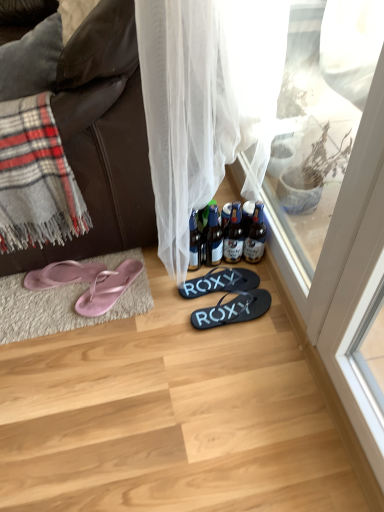
Find the location of a particular element. The image size is (384, 512). dark brown leather couch at left is located at coordinates (102, 139).

What is the approximate width of black rubber flip flops at center, placed as the 2th footwear when sorted from right to left?

black rubber flip flops at center, placed as the 2th footwear when sorted from right to left, is 11.16 inches wide.

Consider the image. Measure the distance between translucent glass bottle at center, which is counted as the 3th bottle, starting from the left, and camera.

translucent glass bottle at center, which is counted as the 3th bottle, starting from the left, is 4.46 feet from camera.

What is the approximate width of translucent glass bottle at center, which ranks as the second bottle in right-to-left order?

3.27 inches.

Identify the location of dark brown leather couch at left. This screenshot has width=384, height=512. (102, 139).

Where is `the 4th bottle behind when counting from the black rubber flip flops at center, which appears as the 1th footwear when viewed from the right`? the 4th bottle behind when counting from the black rubber flip flops at center, which appears as the 1th footwear when viewed from the right is located at coordinates (195, 243).

Is the position of black rubber flip flops at center, which appears as the 1th footwear when viewed from the right, less distant than that of translucent glass bottle at center, the 4th bottle positioned from the right?

Yes, it is.

Considering the relative sizes of black rubber flip flops at center, acting as the 4th footwear starting from the left, and translucent glass bottle at center, the 4th bottle positioned from the right, in the image provided, is black rubber flip flops at center, acting as the 4th footwear starting from the left, taller than translucent glass bottle at center, the 4th bottle positioned from the right,?

No.

Considering the relative sizes of black rubber flip flops at center, placed as the 2th footwear when sorted from right to left, and translucent glass bottle at center, which ranks as the second bottle in right-to-left order, in the image provided, is black rubber flip flops at center, placed as the 2th footwear when sorted from right to left, thinner than translucent glass bottle at center, which ranks as the second bottle in right-to-left order,?

No.

Based on the photo, measure the distance from black rubber flip flops at center, the third footwear when ordered from left to right, to translucent glass bottle at center, which ranks as the second bottle in right-to-left order.

They are 4.11 inches apart.

Is black rubber flip flops at center, the third footwear when ordered from left to right, with translucent glass bottle at center, which is counted as the 3th bottle, starting from the left?

No, black rubber flip flops at center, the third footwear when ordered from left to right, is not beside translucent glass bottle at center, which is counted as the 3th bottle, starting from the left.

Considering the relative positions of black rubber flip flops at center, the third footwear when ordered from left to right, and translucent glass bottle at center, which is counted as the 3th bottle, starting from the left, in the image provided, is black rubber flip flops at center, the third footwear when ordered from left to right, behind translucent glass bottle at center, which is counted as the 3th bottle, starting from the left,?

Yes, black rubber flip flops at center, the third footwear when ordered from left to right, is behind translucent glass bottle at center, which is counted as the 3th bottle, starting from the left.

Can you confirm if translucent glass bottles at center, marked as the second bottle in a left-to-right arrangement, is thinner than brown glass bottles at center, which is the 1th bottle in right-to-left order?

Yes.

Is translucent glass bottles at center, marked as the second bottle in a left-to-right arrangement, shorter than brown glass bottles at center, the 4th bottle in the left-to-right sequence?

No, translucent glass bottles at center, marked as the second bottle in a left-to-right arrangement, is not shorter than brown glass bottles at center, the 4th bottle in the left-to-right sequence.

Locate an element on the screen. The height and width of the screenshot is (512, 384). the 2nd bottle positioned below the brown glass bottles at center, which is the 1th bottle in right-to-left order (from the image's perspective) is located at coordinates (212, 239).

Is point (197, 226) closer or farther from the camera than point (126, 42)?

Point (197, 226) is farther from the camera than point (126, 42).

Would you consider translucent glass bottle at center, the 4th bottle positioned from the right, to be distant from dark brown leather couch at left?

translucent glass bottle at center, the 4th bottle positioned from the right, is actually quite close to dark brown leather couch at left.

Is translucent glass bottle at center, the 4th bottle positioned from the right, closer to camera compared to dark brown leather couch at left?

No, it is not.

How many degrees apart are the facing directions of translucent glass bottle at center, the 4th bottle positioned from the right, and dark brown leather couch at left?

86.2 degrees.

Based on the photo, choose the correct answer: Is black rubber flip flops at center, placed as the 2th footwear when sorted from right to left, inside brown glass bottles at center, the 4th bottle in the left-to-right sequence, or outside it?

black rubber flip flops at center, placed as the 2th footwear when sorted from right to left, cannot be found inside brown glass bottles at center, the 4th bottle in the left-to-right sequence.

Is black rubber flip flops at center, placed as the 2th footwear when sorted from right to left, far from brown glass bottles at center, which is the 1th bottle in right-to-left order?

No, black rubber flip flops at center, placed as the 2th footwear when sorted from right to left, is in close proximity to brown glass bottles at center, which is the 1th bottle in right-to-left order.

From the image's perspective, which is below, black rubber flip flops at center, placed as the 2th footwear when sorted from right to left, or brown glass bottles at center, which is the 1th bottle in right-to-left order?

black rubber flip flops at center, placed as the 2th footwear when sorted from right to left, from the image's perspective.

Considering the points (183, 283) and (245, 248), which point is in front, point (183, 283) or point (245, 248)?

Positioned in front is point (183, 283).

Is translucent glass bottles at center, arranged as the third bottle when viewed from the right, not within pink rubber flip-flops at lower left, the third footwear from the right?

That's correct, translucent glass bottles at center, arranged as the third bottle when viewed from the right, is outside of pink rubber flip-flops at lower left, the third footwear from the right.

From a real-world perspective, between translucent glass bottles at center, marked as the second bottle in a left-to-right arrangement, and pink rubber flip-flops at lower left, the third footwear from the right, who is vertically lower?

In real-world perspective, pink rubber flip-flops at lower left, the third footwear from the right, is lower.

Considering the sizes of objects translucent glass bottles at center, arranged as the third bottle when viewed from the right, and pink rubber flip-flops at lower left, which appears as the second footwear when viewed from the left, in the image provided, who is bigger, translucent glass bottles at center, arranged as the third bottle when viewed from the right, or pink rubber flip-flops at lower left, which appears as the second footwear when viewed from the left,?

pink rubber flip-flops at lower left, which appears as the second footwear when viewed from the left.

Between point (221, 254) and point (98, 282), which one is positioned in front?

The point (98, 282) is in front.

Is translucent glass bottle at center, the 1th bottle positioned from the left, further to the viewer compared to gray plaid blanket at left?

Yes, translucent glass bottle at center, the 1th bottle positioned from the left, is behind gray plaid blanket at left.

Between translucent glass bottle at center, the 1th bottle positioned from the left, and gray plaid blanket at left, which one has less height?

With less height is translucent glass bottle at center, the 1th bottle positioned from the left.

Is translucent glass bottle at center, the 1th bottle positioned from the left, situated inside gray plaid blanket at left or outside?

translucent glass bottle at center, the 1th bottle positioned from the left, exists outside the volume of gray plaid blanket at left.

You are a GUI agent. You are given a task and a screenshot of the screen. Output one action in this format:
    pyautogui.click(x=<x>, y=<y>)
    Task: Click on the 2nd footwear in front of the translucent glass bottle at center, the 4th bottle positioned from the right, starting your count from the anchor
    
    Given the screenshot: What is the action you would take?
    pyautogui.click(x=233, y=309)

This screenshot has height=512, width=384. In order to click on the 3rd footwear located beneath the translucent glass bottle at center, which ranks as the second bottle in right-to-left order (from a real-world perspective) in this screenshot , I will do `click(220, 282)`.

Considering their positions, is pink rubber flip-flops at lower left, the third footwear from the right, positioned further to black rubber flip flops at center, acting as the 4th footwear starting from the left, than translucent glass bottles at center, marked as the second bottle in a left-to-right arrangement?

pink rubber flip-flops at lower left, the third footwear from the right.

Looking at the image, which one is located further to pink rubber flip-flops at left, the fourth footwear from the right, gray plaid blanket at left or dark brown leather couch at left?

Based on the image, gray plaid blanket at left appears to be further to pink rubber flip-flops at left, the fourth footwear from the right.

Based on their spatial positions, is brown glass bottles at center, which is the 1th bottle in right-to-left order, or translucent glass bottle at center, the 1th bottle positioned from the left, closer to black rubber flip flops at center, acting as the 4th footwear starting from the left?

brown glass bottles at center, which is the 1th bottle in right-to-left order, is closer to black rubber flip flops at center, acting as the 4th footwear starting from the left.

Based on their spatial positions, is black rubber flip flops at center, which appears as the 1th footwear when viewed from the right, or translucent glass bottles at center, marked as the second bottle in a left-to-right arrangement, further from pink rubber flip-flops at left, the fourth footwear from the right?

Among the two, black rubber flip flops at center, which appears as the 1th footwear when viewed from the right, is located further to pink rubber flip-flops at left, the fourth footwear from the right.

When comparing their distances from black rubber flip flops at center, placed as the 2th footwear when sorted from right to left, does translucent glass bottle at center, which ranks as the second bottle in right-to-left order, or pink rubber flip-flops at lower left, which appears as the second footwear when viewed from the left, seem closer?

translucent glass bottle at center, which ranks as the second bottle in right-to-left order, is positioned closer to the anchor black rubber flip flops at center, placed as the 2th footwear when sorted from right to left.

Based on their spatial positions, is translucent glass bottle at center, the 1th bottle positioned from the left, or translucent glass bottles at center, arranged as the third bottle when viewed from the right, closer to dark brown leather couch at left?

translucent glass bottle at center, the 1th bottle positioned from the left, is closer to dark brown leather couch at left.

Which object lies further to the anchor point pink rubber flip-flops at lower left, the third footwear from the right, black rubber flip flops at center, acting as the 4th footwear starting from the left, or pink rubber flip-flops at left, the 1th footwear viewed from the left?

black rubber flip flops at center, acting as the 4th footwear starting from the left, is positioned further to the anchor pink rubber flip-flops at lower left, the third footwear from the right.

When comparing their distances from translucent glass bottle at center, the 4th bottle positioned from the right, does pink rubber flip-flops at left, the fourth footwear from the right, or translucent glass bottles at center, marked as the second bottle in a left-to-right arrangement, seem closer?

Based on the image, translucent glass bottles at center, marked as the second bottle in a left-to-right arrangement, appears to be nearer to translucent glass bottle at center, the 4th bottle positioned from the right.

Where is `footwear between dark brown leather couch at left and black rubber flip flops at center, the third footwear when ordered from left to right, vertically`? footwear between dark brown leather couch at left and black rubber flip flops at center, the third footwear when ordered from left to right, vertically is located at coordinates (63, 274).

This screenshot has height=512, width=384. I want to click on bottle between translucent glass bottles at center, marked as the second bottle in a left-to-right arrangement, and black rubber flip flops at center, acting as the 4th footwear starting from the left, in the up-down direction, so click(x=195, y=243).

Find the location of a particular element. Image resolution: width=384 pixels, height=512 pixels. bottle between dark brown leather couch at left and translucent glass bottle at center, which is counted as the 3th bottle, starting from the left, from top to bottom is located at coordinates (256, 236).

This screenshot has height=512, width=384. What are the coordinates of `plaid between dark brown leather couch at left and pink rubber flip-flops at lower left, which appears as the second footwear when viewed from the left, from top to bottom` in the screenshot? It's located at (36, 179).